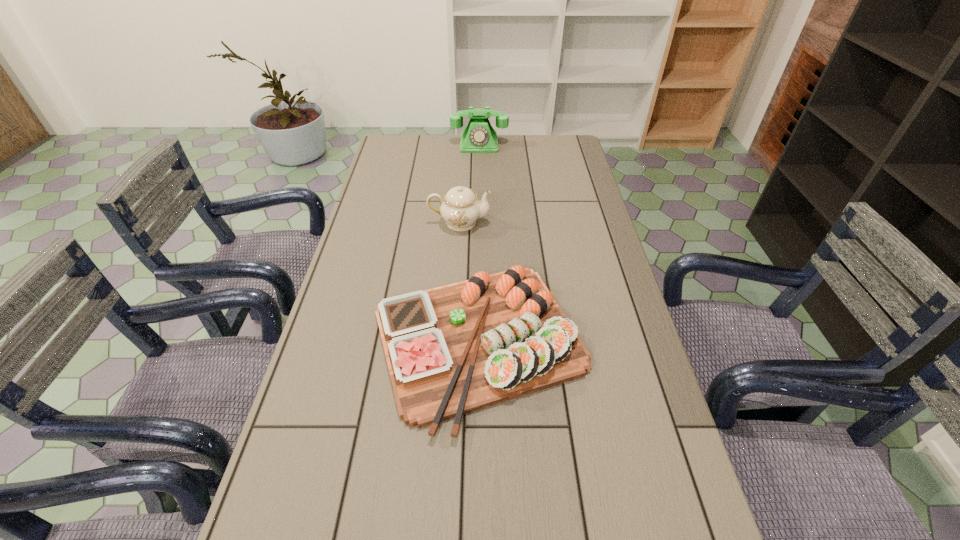
The height and width of the screenshot is (540, 960). In the image, there is a desktop. Find the location of `vacant space at the far edge`. vacant space at the far edge is located at coordinates (450, 144).

Where is `free space at the left edge of the desktop`? This screenshot has height=540, width=960. free space at the left edge of the desktop is located at coordinates (329, 455).

In the image, there is a desktop. Where is `free region at the right edge`? The image size is (960, 540). free region at the right edge is located at coordinates (593, 350).

The width and height of the screenshot is (960, 540). Find the location of `vacant region at the far left corner of the desktop`. vacant region at the far left corner of the desktop is located at coordinates (422, 144).

What are the coordinates of `free space at the far right corner` in the screenshot? It's located at (576, 149).

Image resolution: width=960 pixels, height=540 pixels. What are the coordinates of `free space between the chinaware and the telephone` in the screenshot? It's located at (469, 183).

You are a GUI agent. You are given a task and a screenshot of the screen. Output one action in this format:
    pyautogui.click(x=<x>, y=<y>)
    Task: Click on the vacant space that's between the second nearest object and the farthest object
    Image resolution: width=960 pixels, height=540 pixels.
    Given the screenshot: What is the action you would take?
    pyautogui.click(x=469, y=183)

Find the location of a particular element. The image size is (960, 540). the closest object to the platter is located at coordinates (460, 208).

Identify which object is the closest to the telephone. Please provide its 2D coordinates. Your answer should be formatted as a tuple, i.e. [(x, y)], where the tuple contains the x and y coordinates of a point satisfying the conditions above.

[(460, 208)]

Find the location of `vacant space that satisfies the following two spatial constraints: 1. on the dial of the farthest object; 2. at the spout of the second farthest object`. vacant space that satisfies the following two spatial constraints: 1. on the dial of the farthest object; 2. at the spout of the second farthest object is located at coordinates (479, 222).